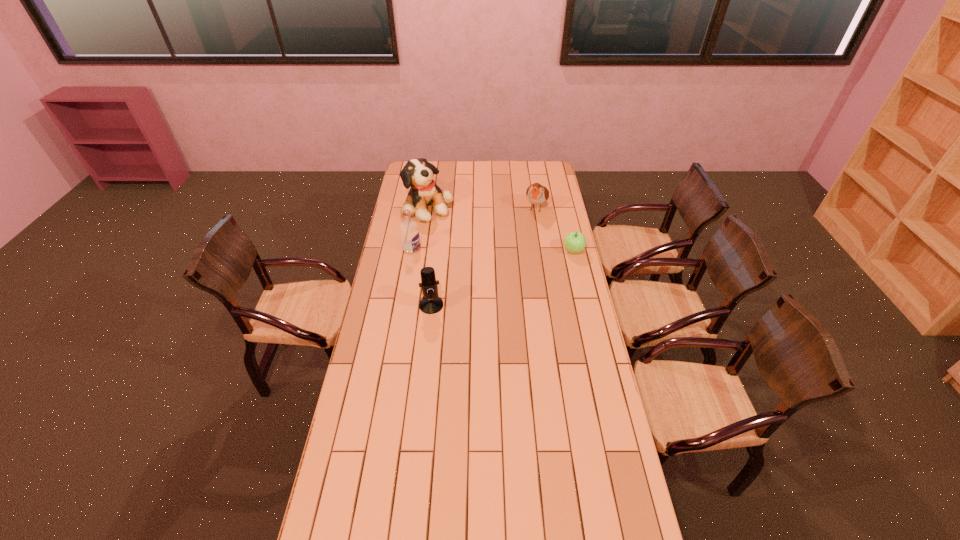
Find the location of a particular element. The width and height of the screenshot is (960, 540). free point between the vodka and the shortest object is located at coordinates (492, 250).

Locate an element on the screen. The image size is (960, 540). empty location between the bird and the puppy is located at coordinates (483, 207).

Locate an element on the screen. The width and height of the screenshot is (960, 540). vacant area that lies between the puppy and the vodka is located at coordinates (420, 227).

This screenshot has height=540, width=960. In order to click on object that is the closest to the vodka in this screenshot , I will do `click(418, 173)`.

Locate which object ranks in proximity to the nearest object. Please provide its 2D coordinates. Your answer should be formatted as a tuple, i.e. [(x, y)], where the tuple contains the x and y coordinates of a point satisfying the conditions above.

[(409, 232)]